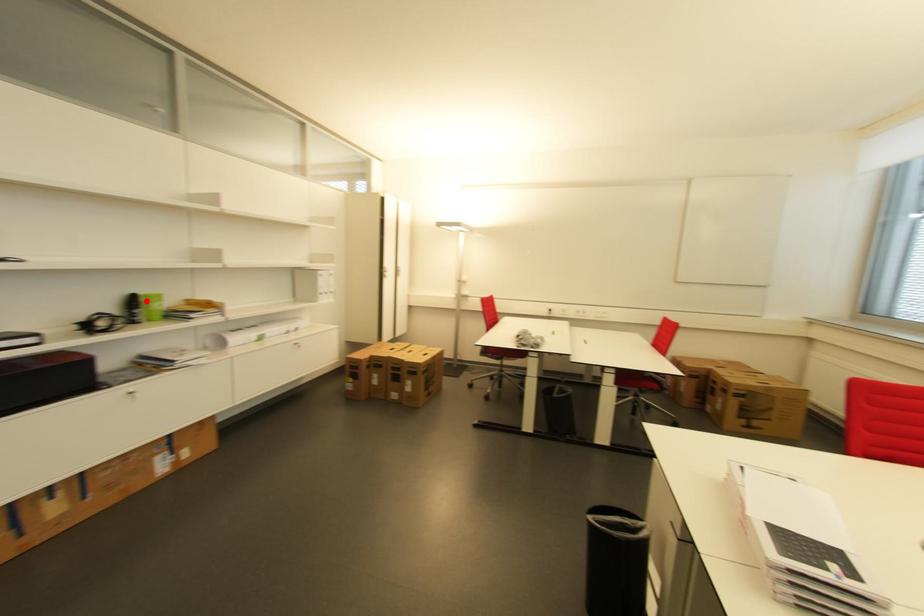
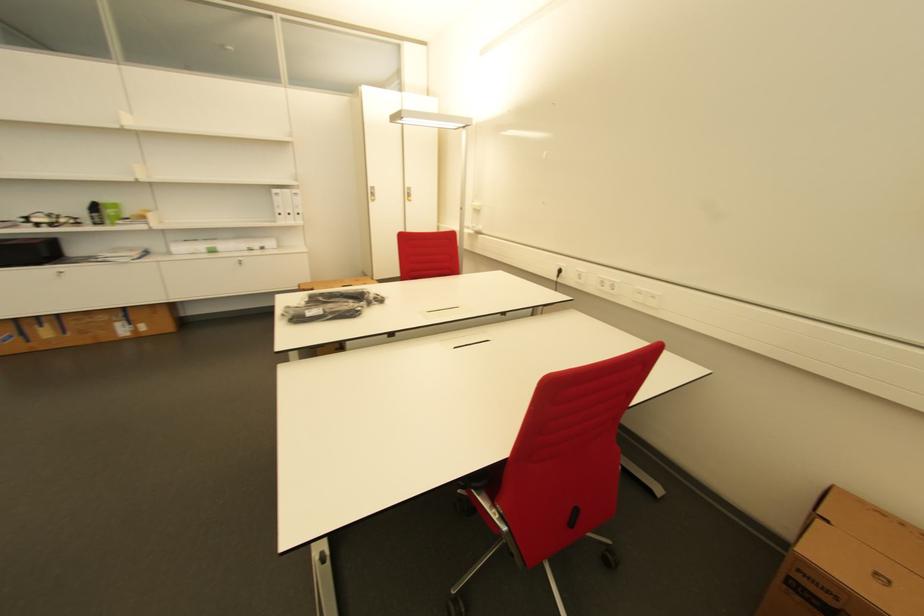
Where in the second image is the point corresponding to the highlighted location from the first image?

(104, 208)